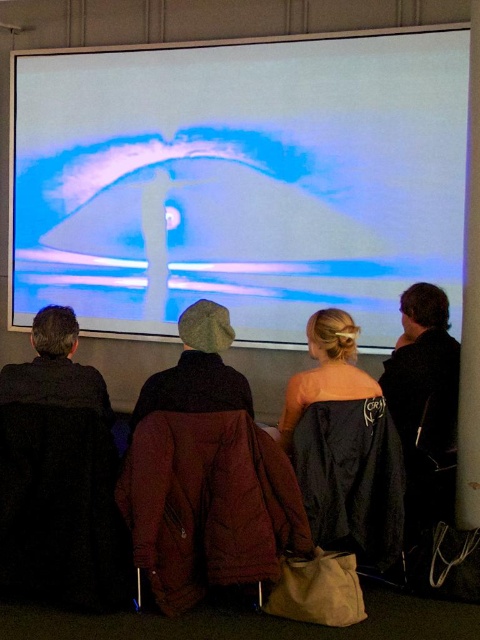
Question: Can you confirm if black matte jacket at right is positioned to the left of black fuzzy hat at left?

Choices:
 (A) no
 (B) yes

Answer: (A)

Question: Does white glossy projection screen at upper center appear over black fuzzy hat at left?

Choices:
 (A) no
 (B) yes

Answer: (B)

Question: Can you confirm if brown woolen hat at center is bigger than black satin dress at center?

Choices:
 (A) yes
 (B) no

Answer: (A)

Question: Among these objects, which one is nearest to the camera?

Choices:
 (A) black satin dress at center
 (B) brown woolen hat at center
 (C) white glossy projection screen at upper center
 (D) black matte jacket at right

Answer: (B)

Question: Estimate the real-world distances between objects in this image. Which object is farther from the black fuzzy hat at left?

Choices:
 (A) white glossy projection screen at upper center
 (B) black matte jacket at right
 (C) black satin dress at center
 (D) brown woolen hat at center

Answer: (A)

Question: Which is farther from the brown woolen hat at center?

Choices:
 (A) black fuzzy hat at left
 (B) black satin dress at center
 (C) white glossy projection screen at upper center

Answer: (C)